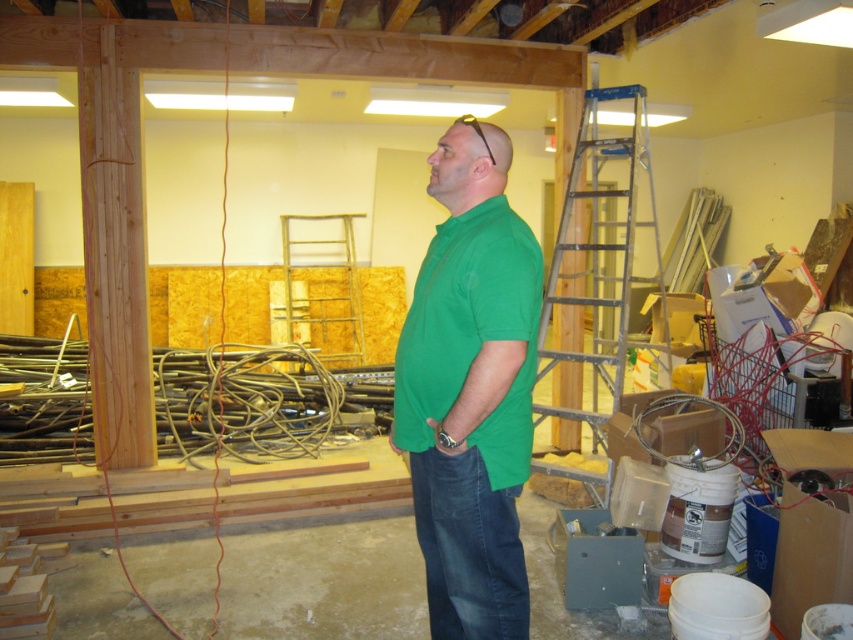
Question: Does silver metallic ladder at right have a lesser width compared to metallic silver ladder at center?

Choices:
 (A) no
 (B) yes

Answer: (B)

Question: Can you confirm if green matte shirt at center is positioned to the left of silver metallic ladder at right?

Choices:
 (A) yes
 (B) no

Answer: (A)

Question: Considering the real-world distances, which object is closest to the silver metallic ladder at right?

Choices:
 (A) metallic silver ladder at center
 (B) green matte shirt at center

Answer: (B)

Question: Where is green matte shirt at center located in relation to silver metallic ladder at right in the image?

Choices:
 (A) left
 (B) right

Answer: (A)

Question: Among these points, which one is farthest from the camera?

Choices:
 (A) (576, 225)
 (B) (509, 524)

Answer: (A)

Question: Which point appears closest to the camera in this image?

Choices:
 (A) (345, 216)
 (B) (560, 244)
 (C) (489, 392)

Answer: (C)